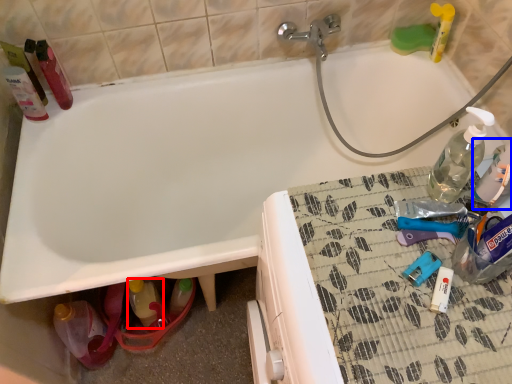
Question: Among these objects, which one is nearest to the camera, bottle (highlighted by a red box) or bottle (highlighted by a blue box)?

Choices:
 (A) bottle
 (B) bottle

Answer: (B)